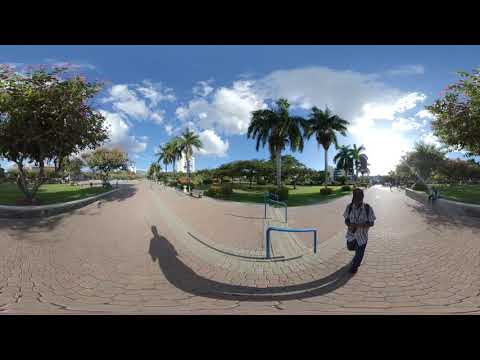
At what (x,y) coordinates should I click in order to perform the action: click on wall. Please return your answer as a coordinate pair (x, y). This screenshot has width=480, height=360. Looking at the image, I should click on (464, 208).